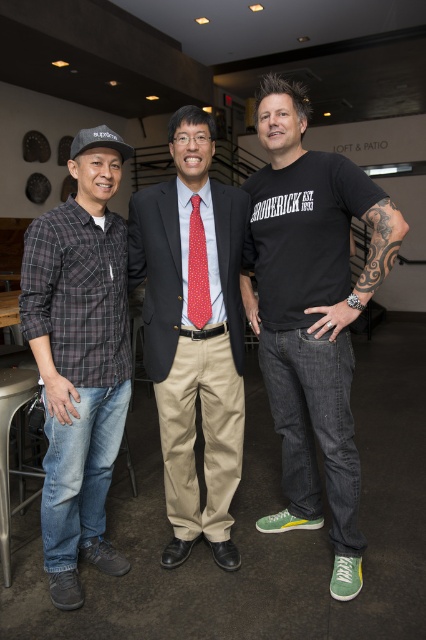
Question: Based on their relative distances, which object is nearer to the black matte t-shirt at right?

Choices:
 (A) red dotted tie at center
 (B) brushed metal bar stool at lower left

Answer: (A)

Question: From the image, what is the correct spatial relationship of red dotted tie at center in relation to red dotted fabric tie at center?

Choices:
 (A) below
 (B) above

Answer: (A)

Question: Which point is farther to the camera?

Choices:
 (A) plaid cotton shirt at left
 (B) black matte t-shirt at right
 (C) red dotted tie at center

Answer: (C)

Question: Is the position of brushed metal bar stool at lower left less distant than that of red dotted fabric tie at center?

Choices:
 (A) yes
 (B) no

Answer: (B)

Question: Which point is closer to the camera?

Choices:
 (A) red dotted fabric tie at center
 (B) red dotted tie at center
 (C) black matte t-shirt at right
 (D) plaid cotton shirt at left

Answer: (C)

Question: Can you confirm if red dotted tie at center is bigger than red dotted fabric tie at center?

Choices:
 (A) no
 (B) yes

Answer: (B)